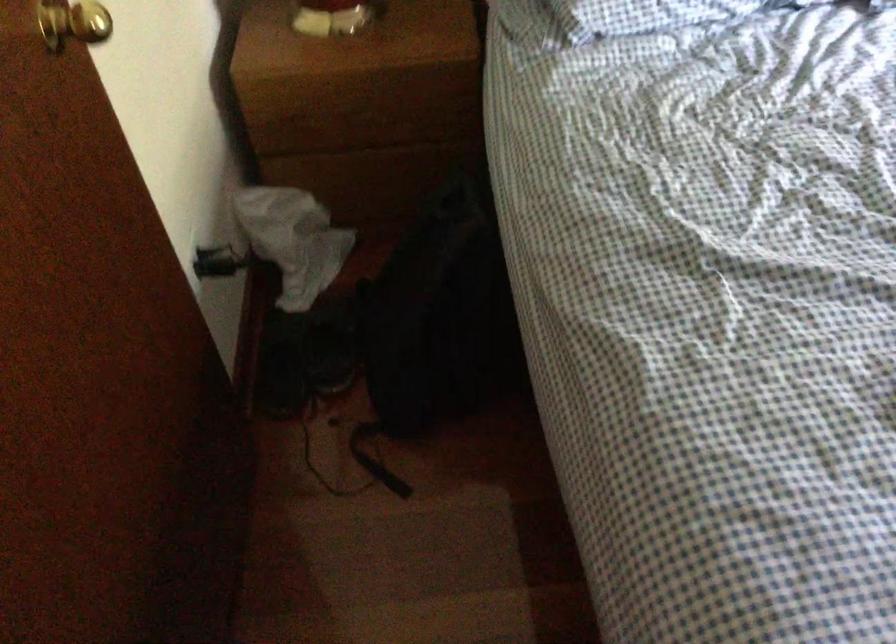
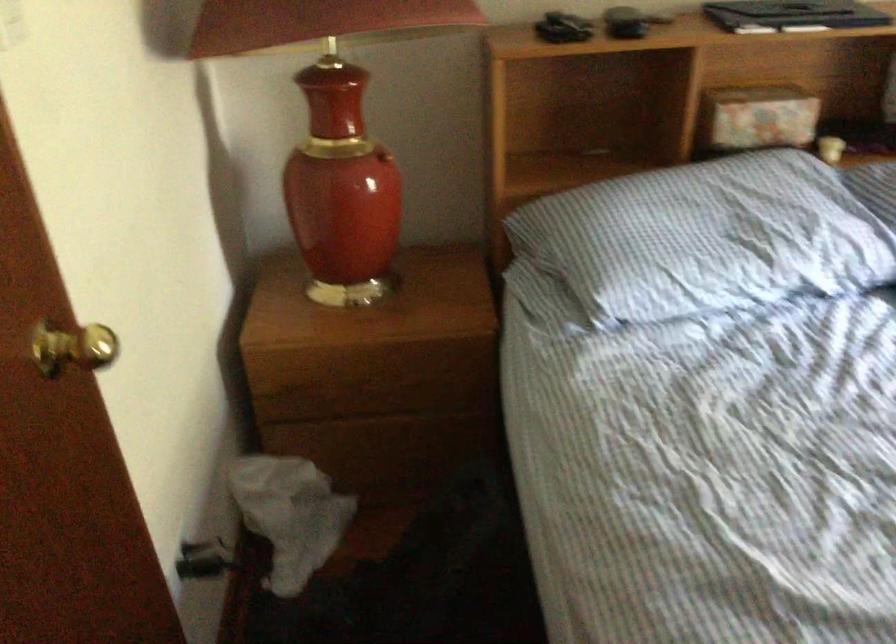
Question: Based on the continuous images, in which direction is the camera rotating? Reply with the corresponding letter.

Choices:
 (A) Left
 (B) Right
 (C) Up
 (D) Down

Answer: (C)